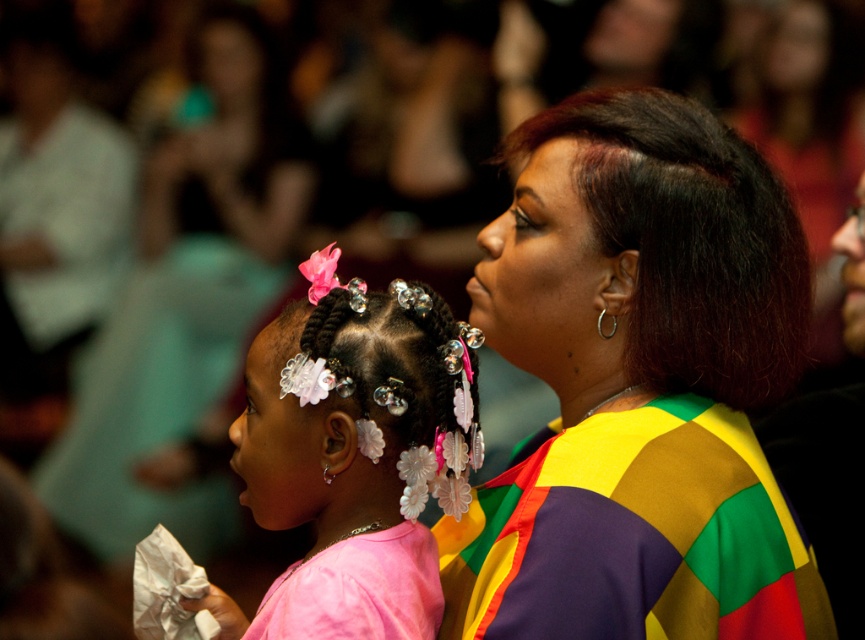
Question: Can you confirm if multicolored fabric at center is wider than dark glossy hair at center?

Choices:
 (A) no
 (B) yes

Answer: (B)

Question: Does multicolored fabric at center have a lesser width compared to pink satin dress at lower left?

Choices:
 (A) yes
 (B) no

Answer: (B)

Question: Which point is closer to the camera taking this photo?

Choices:
 (A) (649, 285)
 (B) (273, 332)
 (C) (729, 547)

Answer: (C)

Question: Is the position of multicolored fabric at center more distant than that of pink fabric at center?

Choices:
 (A) yes
 (B) no

Answer: (B)

Question: Which object is positioned closest to the dark glossy hair at center?

Choices:
 (A) pink satin dress at lower left
 (B) multicolored fabric dress at center

Answer: (B)

Question: Which object is the closest to the pink satin dress at lower left?

Choices:
 (A) multicolored fabric at center
 (B) pink fabric at center

Answer: (B)